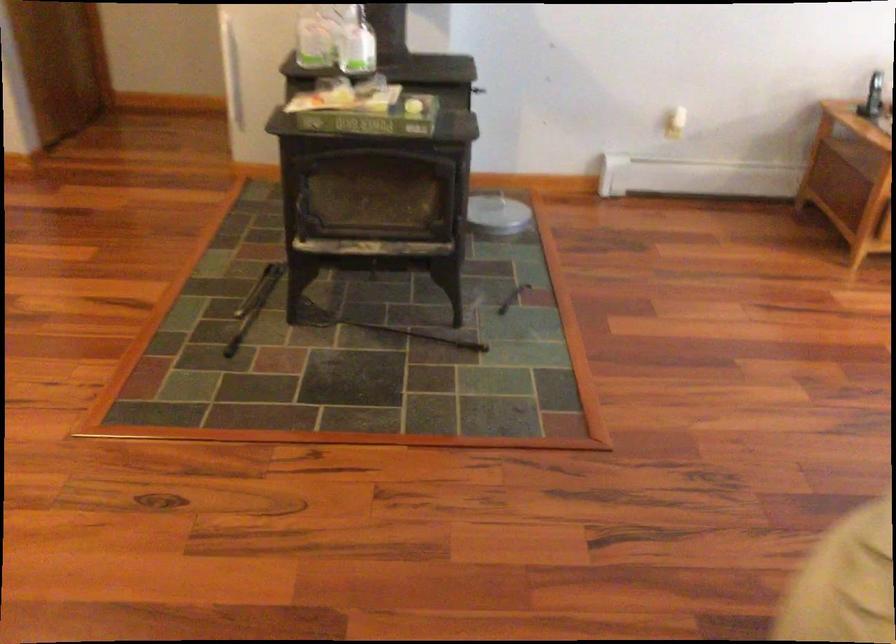
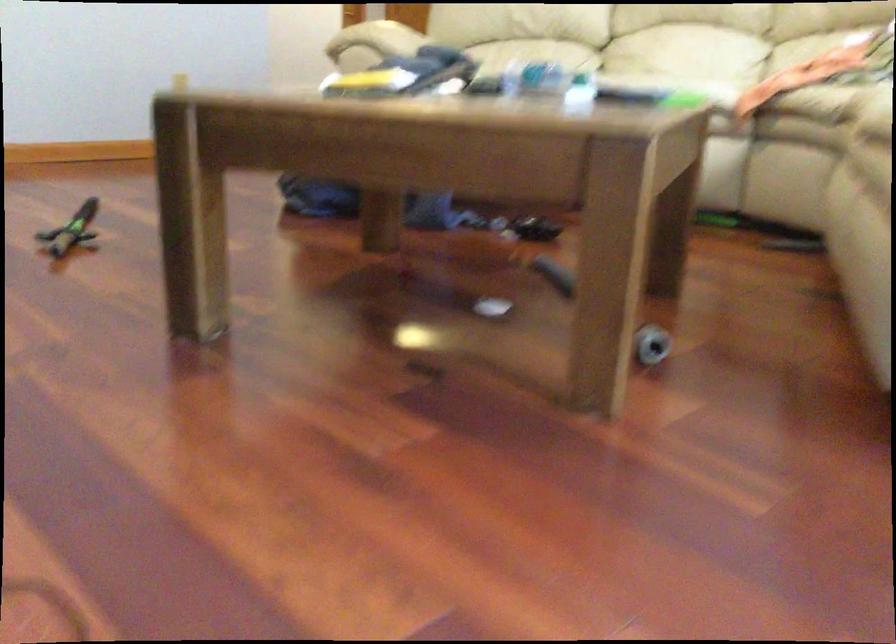
Question: I am providing you with two images of the same scene from different viewpoints. Which of the following objects are not visible in image2?

Choices:
 (A) sofa armrest
 (B) black metal tool
 (C) green paper tray
 (D) sofa sitting surface

Answer: (B)